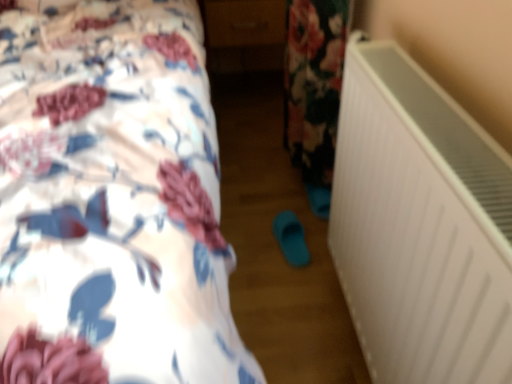
Question: Does floral fabric bed at upper left have a greater height compared to matte brown drawer at center?

Choices:
 (A) no
 (B) yes

Answer: (B)

Question: Would you say matte brown drawer at center is part of floral fabric bed at upper left's contents?

Choices:
 (A) yes
 (B) no

Answer: (B)

Question: Does floral fabric bed at upper left have a greater width compared to matte brown drawer at center?

Choices:
 (A) yes
 (B) no

Answer: (A)

Question: From the image's perspective, is floral fabric bed at upper left below matte brown drawer at center?

Choices:
 (A) no
 (B) yes

Answer: (B)

Question: Is floral fabric bed at upper left completely or partially outside of matte brown drawer at center?

Choices:
 (A) no
 (B) yes

Answer: (B)

Question: Is white matte radiator at right taller or shorter than floral fabric bed at upper left?

Choices:
 (A) tall
 (B) short

Answer: (B)

Question: From a real-world perspective, is white matte radiator at right above or below floral fabric bed at upper left?

Choices:
 (A) below
 (B) above

Answer: (A)

Question: Would you say white matte radiator at right is inside or outside floral fabric bed at upper left?

Choices:
 (A) inside
 (B) outside

Answer: (B)

Question: Looking at the image, does white matte radiator at right seem bigger or smaller compared to floral fabric bed at upper left?

Choices:
 (A) small
 (B) big

Answer: (A)

Question: Is teal rubber slipper at center taller or shorter than matte brown drawer at center?

Choices:
 (A) tall
 (B) short

Answer: (B)

Question: Is teal rubber slipper at center in front of or behind matte brown drawer at center in the image?

Choices:
 (A) front
 (B) behind

Answer: (A)

Question: From the image's perspective, is teal rubber slipper at center located above or below matte brown drawer at center?

Choices:
 (A) above
 (B) below

Answer: (B)

Question: From a real-world perspective, is teal rubber slipper at center physically located above or below matte brown drawer at center?

Choices:
 (A) above
 (B) below

Answer: (B)

Question: Is teal rubber slipper at center wider or thinner than floral fabric bed at upper left?

Choices:
 (A) wide
 (B) thin

Answer: (B)

Question: From a real-world perspective, is teal rubber slipper at center physically located above or below floral fabric bed at upper left?

Choices:
 (A) above
 (B) below

Answer: (B)